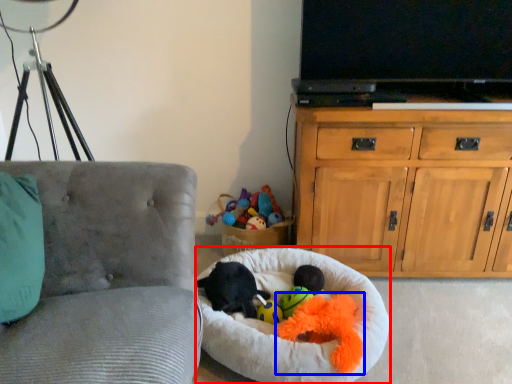
Question: Which of the following is the closest to the observer, dog bed (highlighted by a red box) or toy (highlighted by a blue box)?

Choices:
 (A) dog bed
 (B) toy

Answer: (A)